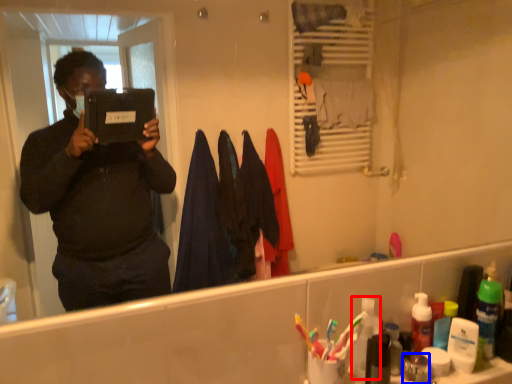
Question: Which object appears closest to the camera in this image, toiletry (highlighted by a red box) or toiletry (highlighted by a blue box)?

Choices:
 (A) toiletry
 (B) toiletry

Answer: (B)